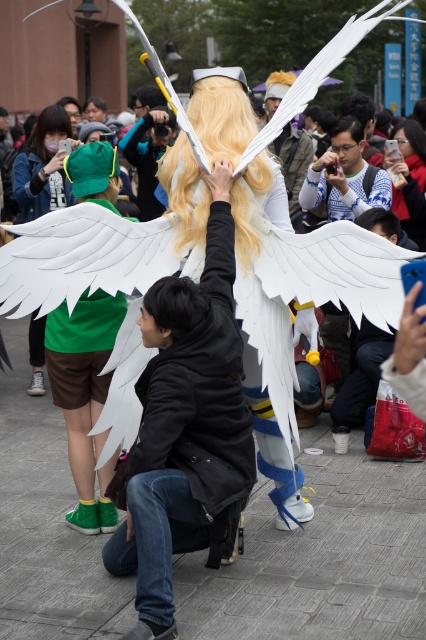
Who is positioned more to the left, blonde hair at center or matte white wings at center?

Positioned to the left is blonde hair at center.

This screenshot has height=640, width=426. What are the coordinates of `blonde hair at center` in the screenshot? It's located at (221, 116).

Can you confirm if blonde hair at center is taller than golden hair at center?

Correct, blonde hair at center is much taller as golden hair at center.

Between blonde hair at center and golden hair at center, which one has more height?

Standing taller between the two is blonde hair at center.

Describe the element at coordinates (221, 116) in the screenshot. I see `blonde hair at center` at that location.

Locate an element on the screen. The image size is (426, 640). blonde hair at center is located at coordinates (221, 116).

Can you confirm if matte black camera at center is positioned to the right of matte white wings at center?

Incorrect, matte black camera at center is not on the right side of matte white wings at center.

What do you see at coordinates (147, 156) in the screenshot?
I see `matte black camera at center` at bounding box center [147, 156].

Find the location of a particular element. The width and height of the screenshot is (426, 640). matte black camera at center is located at coordinates (147, 156).